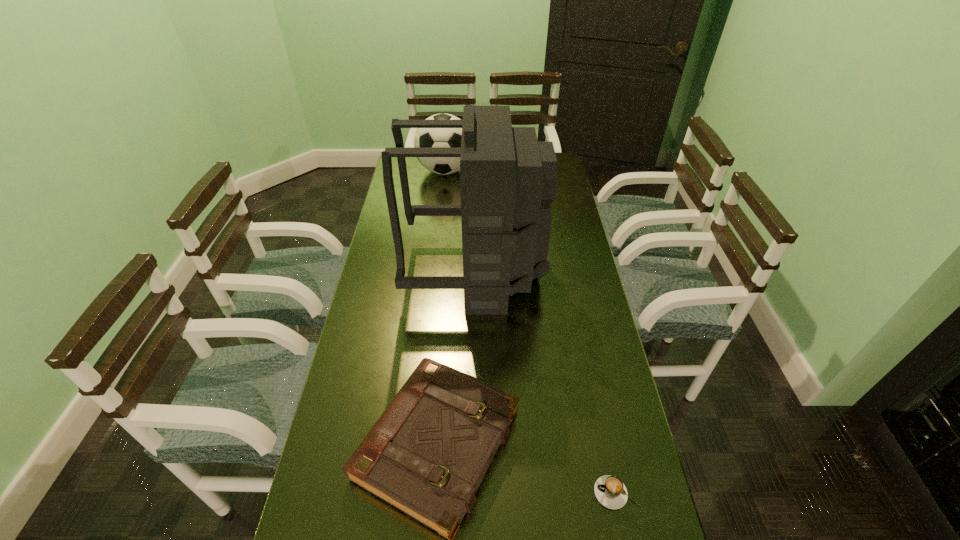
Image resolution: width=960 pixels, height=540 pixels. Find the location of `free space between the second tallest object and the rightmost object`. free space between the second tallest object and the rightmost object is located at coordinates (531, 332).

Where is `free spot between the cappuccino and the second tallest object`? free spot between the cappuccino and the second tallest object is located at coordinates (531, 332).

Select which object is the closest to the backpack. Please provide its 2D coordinates. Your answer should be formatted as a tuple, i.e. [(x, y)], where the tuple contains the x and y coordinates of a point satisfying the conditions above.

[(427, 454)]

Choose which object is the nearest neighbor to the backpack. Please provide its 2D coordinates. Your answer should be formatted as a tuple, i.e. [(x, y)], where the tuple contains the x and y coordinates of a point satisfying the conditions above.

[(427, 454)]